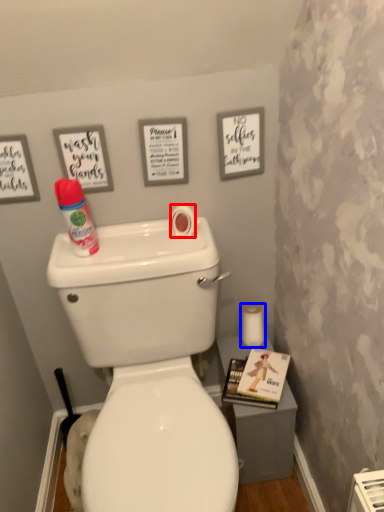
Question: Which of the following is the farthest to the observer, toilet paper (highlighted by a red box) or toilet paper (highlighted by a blue box)?

Choices:
 (A) toilet paper
 (B) toilet paper

Answer: (B)